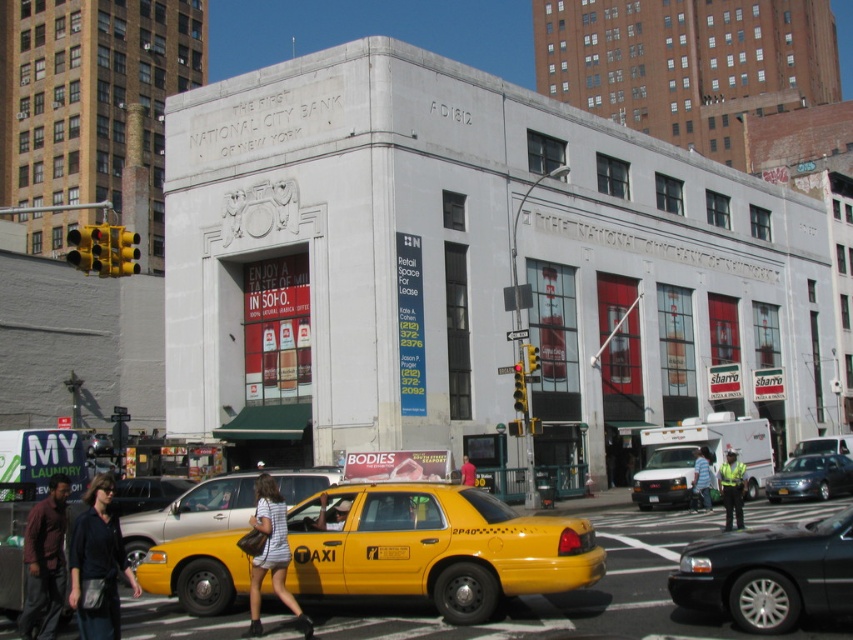
Question: Does yellow matte taxi cab at center come in front of metallic blue sedan at lower right?

Choices:
 (A) no
 (B) yes

Answer: (B)

Question: Among these objects, which one is farthest from the camera?

Choices:
 (A) reflective yellow vest at lower right
 (B) yellow matte taxi at lower center
 (C) striped fabric dress at center
 (D) maroon shirt at lower left

Answer: (A)

Question: Based on their relative distances, which object is nearer to the black rubber car at lower right?

Choices:
 (A) striped fabric dress at center
 (B) dark blue fabric jacket at lower left

Answer: (A)

Question: In this image, where is yellow matte taxi at lower center located relative to metallic silver taxi cab at lower center?

Choices:
 (A) right
 (B) left

Answer: (A)

Question: Which of these objects is positioned farthest from the black rubber car at lower right?

Choices:
 (A) metallic blue sedan at lower right
 (B) maroon shirt at lower left

Answer: (A)

Question: Does striped fabric dress at center lie behind reflective yellow vest at lower right?

Choices:
 (A) no
 (B) yes

Answer: (A)